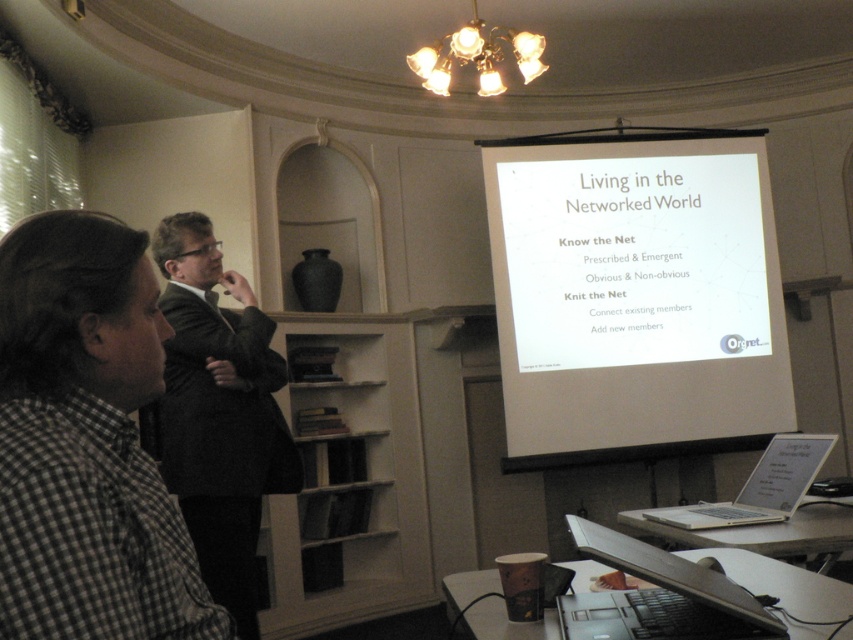
Question: Which point is closer to the camera?

Choices:
 (A) white paper at center
 (B) black plastic keyboard at lower right

Answer: (B)

Question: Among these points, which one is farthest from the camera?

Choices:
 (A) tap(585, 173)
 (B) tap(22, 344)
 (C) tap(776, 509)
 (D) tap(624, 536)

Answer: (A)

Question: Does checkered fabric shirt at left appear on the left side of silver metallic laptop at lower right?

Choices:
 (A) no
 (B) yes

Answer: (B)

Question: Where is white paper at center located in relation to black plastic keyboard at lower right in the image?

Choices:
 (A) below
 (B) above

Answer: (B)

Question: Which point is farther to the camera?

Choices:
 (A) (222, 604)
 (B) (624, 538)
 (C) (85, 253)
 (D) (807, 488)

Answer: (A)

Question: Is checkered fabric shirt at left below dark gray suit at left?

Choices:
 (A) yes
 (B) no

Answer: (B)